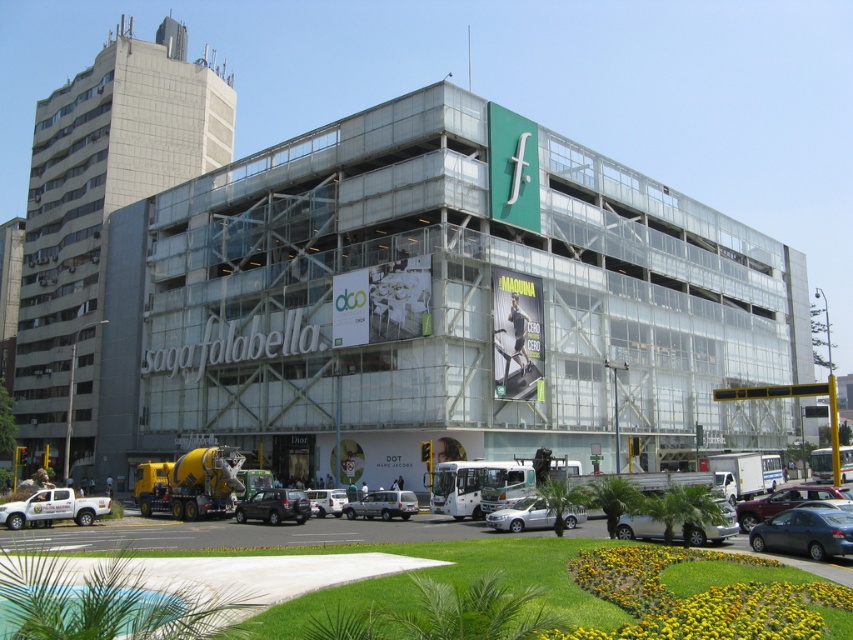
Question: Can you confirm if gray concrete building at left is positioned below white matte truck at lower left?

Choices:
 (A) yes
 (B) no

Answer: (B)

Question: Estimate the real-world distances between objects in this image. Which object is closer to the white matte car at center?

Choices:
 (A) satin black car at center
 (B) white matte truck at lower left
 (C) silver metallic sedan at center

Answer: (A)

Question: Considering the relative positions of silver metallic sedan at center and silver metallic van at center in the image provided, where is silver metallic sedan at center located with respect to silver metallic van at center?

Choices:
 (A) right
 (B) left

Answer: (A)

Question: Which of the following is the farthest from the observer?

Choices:
 (A) (386, 396)
 (B) (529, 516)
 (C) (386, 500)

Answer: (A)

Question: Among these objects, which one is farthest from the camera?

Choices:
 (A) white matte car at center
 (B) metallic silver sedan at lower right

Answer: (A)

Question: Observing the image, what is the correct spatial positioning of transparent glass scaffolding at center in reference to white matte car at center?

Choices:
 (A) right
 (B) left

Answer: (A)